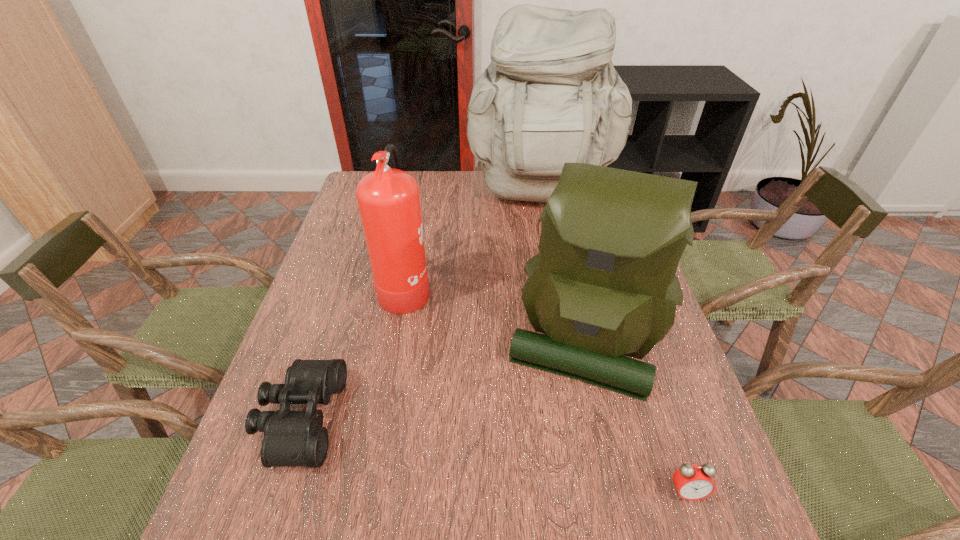
The width and height of the screenshot is (960, 540). In order to click on the farther backpack in this screenshot , I will do `click(551, 95)`.

Locate an element on the screen. Image resolution: width=960 pixels, height=540 pixels. the farthest object is located at coordinates (551, 95).

Identify the location of the fourth object from right to left. (389, 203).

The width and height of the screenshot is (960, 540). I want to click on the shorter backpack, so click(x=603, y=285).

This screenshot has height=540, width=960. Identify the location of binoculars. (291, 438).

Find the location of a particular element. Image resolution: width=960 pixels, height=540 pixels. alarm clock is located at coordinates (693, 482).

Locate an element on the screen. vacant point located on the front-facing side of the tallest object is located at coordinates tap(556, 283).

Where is `free space located 0.360m towards the nozzle of the fire extinguisher`? Image resolution: width=960 pixels, height=540 pixels. free space located 0.360m towards the nozzle of the fire extinguisher is located at coordinates (561, 286).

This screenshot has width=960, height=540. I want to click on free region located on the front of the shorter backpack with visible pockets, so click(610, 458).

The width and height of the screenshot is (960, 540). I want to click on free spot located 0.160m at the eyepieces of the binoculars, so click(x=414, y=418).